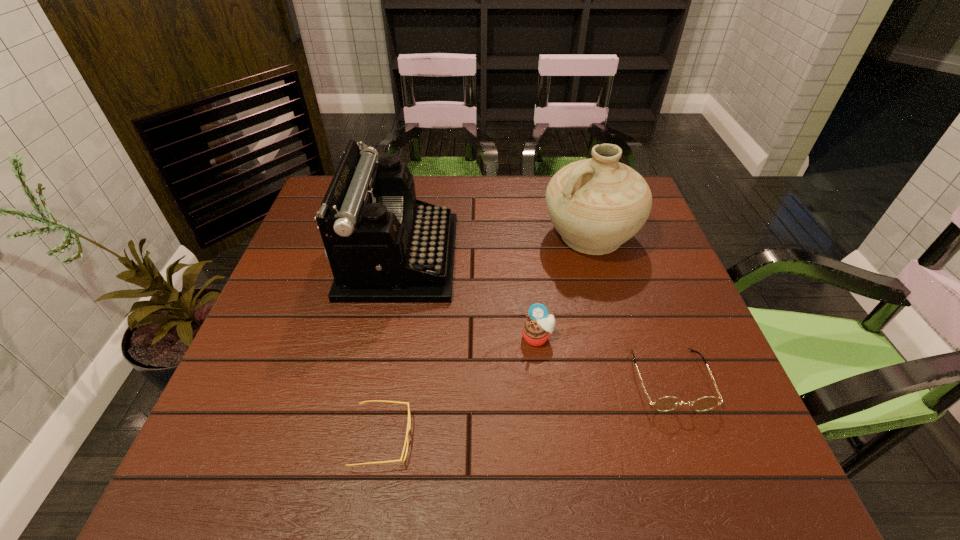
In order to click on vacant space located on the front-facing side of the third tallest object in this screenshot , I will do `click(549, 436)`.

Image resolution: width=960 pixels, height=540 pixels. I want to click on free space located on the lenses of the taller spectacles, so click(x=706, y=477).

Where is `vacant space located in front of the lenses of the shorter spectacles`? vacant space located in front of the lenses of the shorter spectacles is located at coordinates (459, 438).

I want to click on object that is positioned at the far edge, so click(597, 204).

Image resolution: width=960 pixels, height=540 pixels. What are the coordinates of `object present at the near edge` in the screenshot? It's located at (408, 424).

Identify the location of object situated at the left edge. 384,246.

Image resolution: width=960 pixels, height=540 pixels. I want to click on pottery present at the right edge, so click(597, 204).

The image size is (960, 540). Find the location of `spectacles at the right edge`. spectacles at the right edge is located at coordinates (667, 403).

Locate an element on the screen. The height and width of the screenshot is (540, 960). object positioned at the far right corner is located at coordinates (597, 204).

At what (x,y) coordinates should I click in order to perform the action: click on vacant space at the far edge of the desktop. Please return your answer as a coordinate pair (x, y). Looking at the image, I should click on (468, 176).